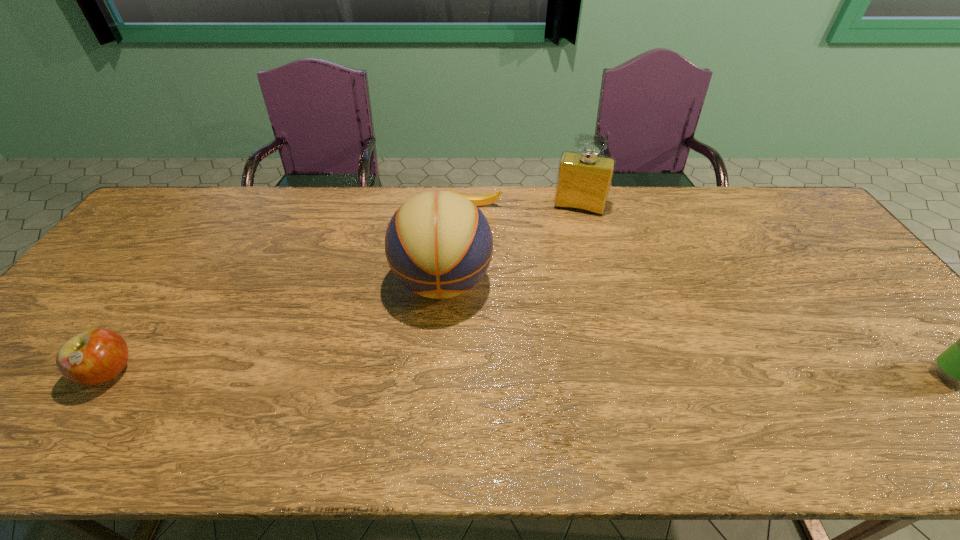
Locate an element on the screen. apple is located at coordinates (95, 356).

What are the coordinates of `the fourth tallest object` in the screenshot? It's located at (95, 356).

Identify the location of the third nearest object. (438, 244).

Locate an element on the screen. the shortest object is located at coordinates (479, 200).

This screenshot has height=540, width=960. What are the coordinates of `perfume` in the screenshot? It's located at (584, 178).

Locate an element on the screen. The image size is (960, 540). vacant space situated 0.130m on the left of the fourth tallest object is located at coordinates (28, 373).

You are a GUI agent. You are given a task and a screenshot of the screen. Output one action in this format:
    pyautogui.click(x=<x>, y=<y>)
    Task: Click on the vacant space located on the patterned surface of the basketball
    The height and width of the screenshot is (540, 960).
    Given the screenshot: What is the action you would take?
    pyautogui.click(x=441, y=367)

I want to click on free space located on the patterned surface of the basketball, so click(x=442, y=340).

This screenshot has height=540, width=960. I want to click on free location located on the patterned surface of the basketball, so click(442, 343).

Image resolution: width=960 pixels, height=540 pixels. I want to click on free point located 0.090m at the stem of the banana, so click(x=478, y=226).